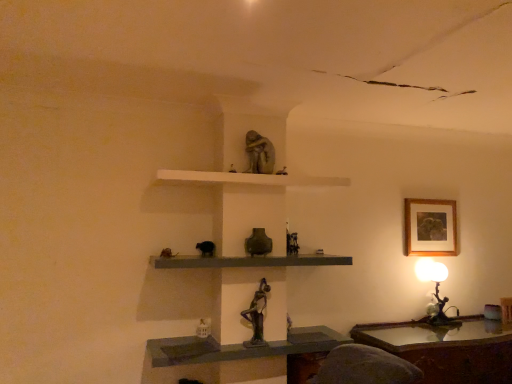
Where is `vacant space in metallic bronze figurine at right (from a real-world perspective)`? vacant space in metallic bronze figurine at right (from a real-world perspective) is located at coordinates (444, 326).